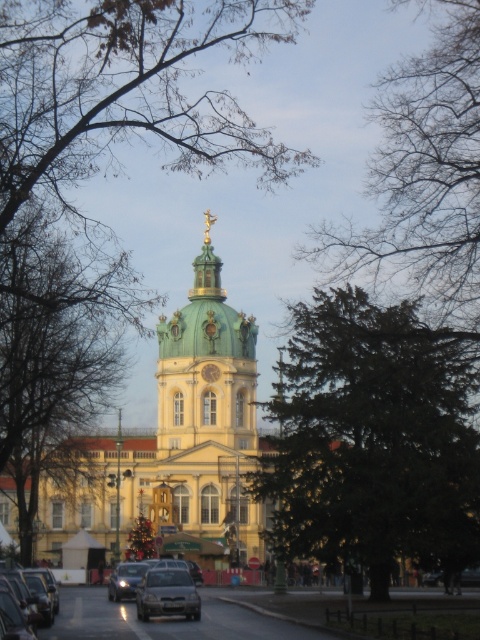
Question: Which of the following is the farthest from the observer?

Choices:
 (A) (86, 400)
 (B) (184, 582)
 (C) (439, 461)

Answer: (A)

Question: Is green textured tree at center smaller than gold metallic clock at center?

Choices:
 (A) no
 (B) yes

Answer: (A)

Question: Is green textured tree at center bigger than gold metallic clock at center?

Choices:
 (A) yes
 (B) no

Answer: (A)

Question: Which is nearer to the green leafy tree at center?

Choices:
 (A) green matte dome at center
 (B) metallic silver car at center
 (C) gold metallic clock at center
 (D) matte silver sedan at center

Answer: (A)

Question: Which point is closer to the camera taking this photo?

Choices:
 (A) pos(39,621)
 (B) pos(15,218)
 (C) pos(210,364)

Answer: (A)

Question: Can you confirm if metallic silver car at center is bigger than gold metallic clock at center?

Choices:
 (A) yes
 (B) no

Answer: (B)